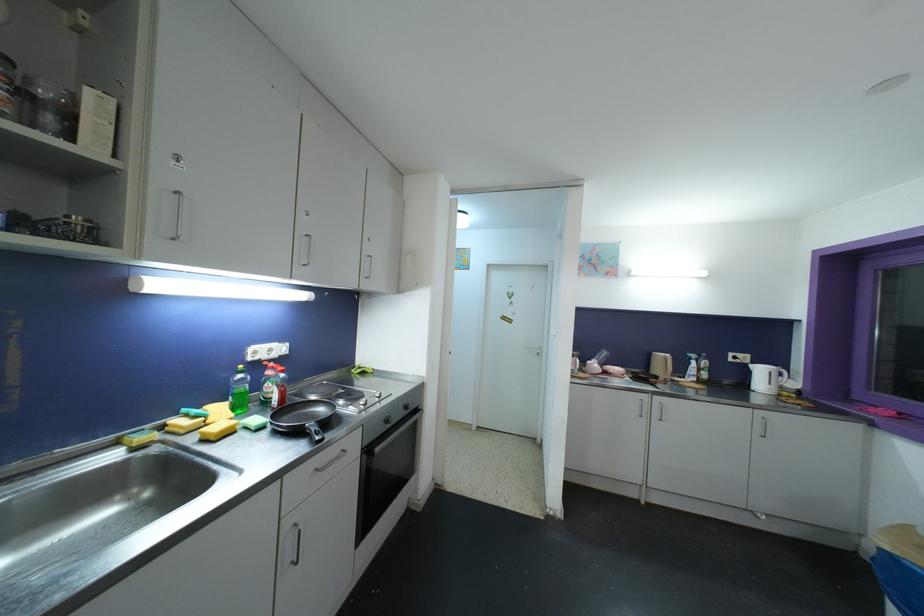
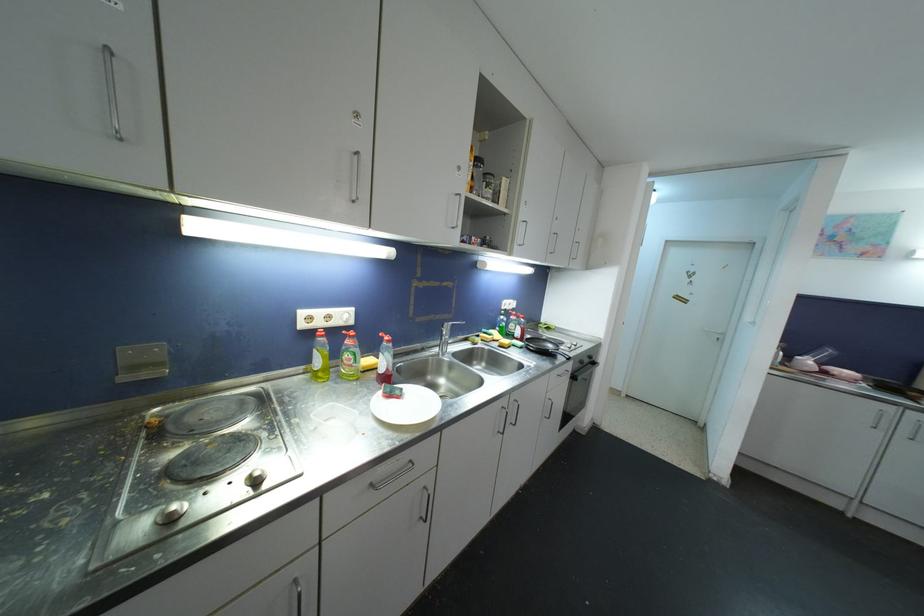
Question: The camera is either moving clockwise (left) or counter-clockwise (right) around the object. The first image is from the beginning of the video and the second image is from the end. Is the camera moving left or right when shooting the video?

Choices:
 (A) Left
 (B) Right

Answer: (B)